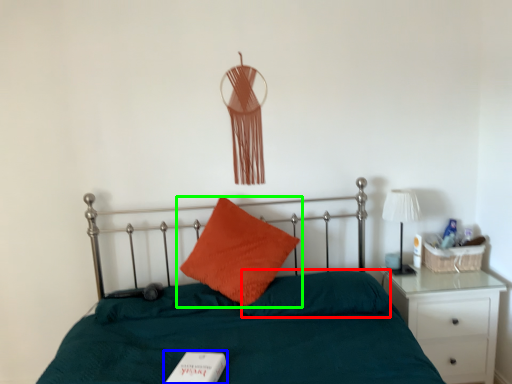
Question: Based on their relative distances, which object is farther from pillow (highlighted by a red box)? Choose from book (highlighted by a blue box) and pillow (highlighted by a green box).

Choices:
 (A) book
 (B) pillow

Answer: (A)